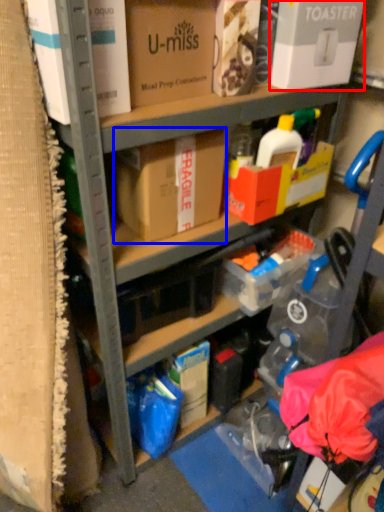
Question: Which object appears farthest to the camera in this image, box (highlighted by a red box) or box (highlighted by a blue box)?

Choices:
 (A) box
 (B) box

Answer: (B)